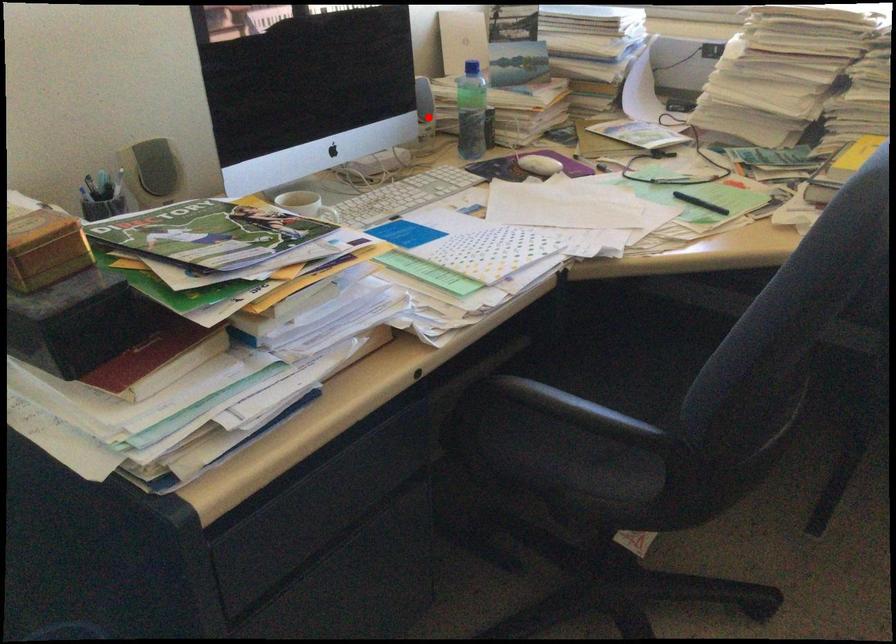
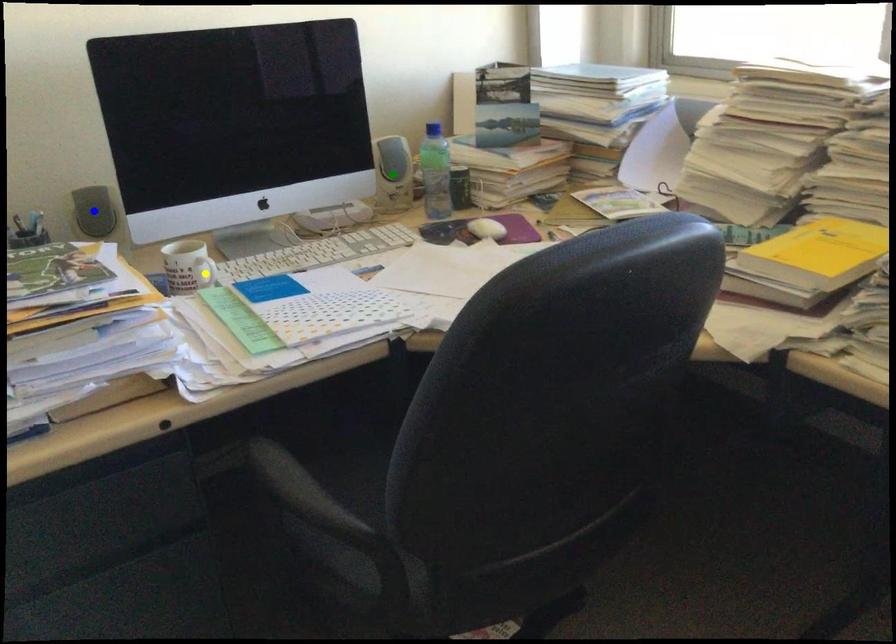
Question: I am providing you with two images of the same scene from different viewpoints. A red point is marked on the first image. You are given multiple points on the second image. Which point in image 2 is actually the same real-world point as the red point in image 1?

Choices:
 (A) blue point
 (B) yellow point
 (C) green point

Answer: (C)